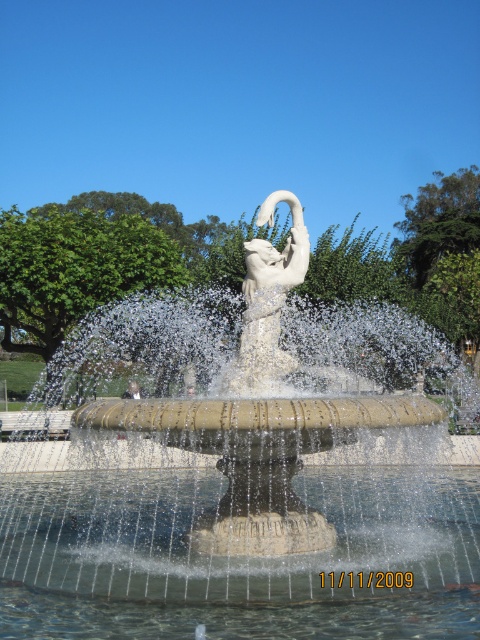
You are standing near the fountain and want to place a small decorative rock. The rock is 10 cm in width. If you want to place it so that it doesn not get wet, where should you place it relative to the clear water at fountain center and the white stone swan at center?

The clear water at fountain center is wider than the white stone swan at center. To keep the decorative rock dry, place it near the white stone swan at center since it has a smaller width compared to the water area.

You are a landscape architect designing a new garden and want to ensure there is enough space between the white stone fountain at center and the clear water at fountain center for visitors to walk around comfortably. According to safety guidelines, a minimum of 2 meters of space is required between such features for pedestrian pathways. Based on the image, is the current spacing sufficient?

The white stone fountain at center and clear water at fountain center are 7.88 meters apart from each other, which exceeds the minimum 2 meters required for pedestrian pathways. Therefore, the current spacing is sufficient.

In the scene shown: You are standing at the edge of the fountain and want to reach the clear water at fountain center located at point (237, 557). What direction should you walk to get there?

You should walk towards the center of the fountain to reach the clear water at fountain center located at point (237, 557).